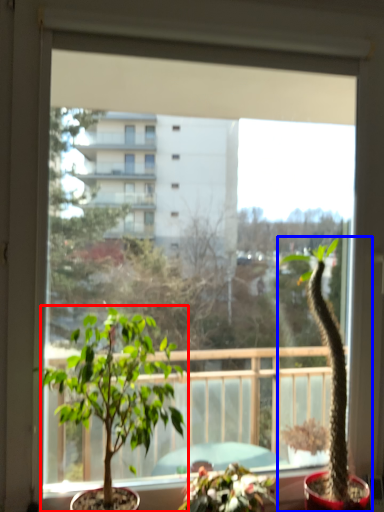
Question: Which object appears farthest to the camera in this image, houseplant (highlighted by a red box) or houseplant (highlighted by a blue box)?

Choices:
 (A) houseplant
 (B) houseplant

Answer: (B)